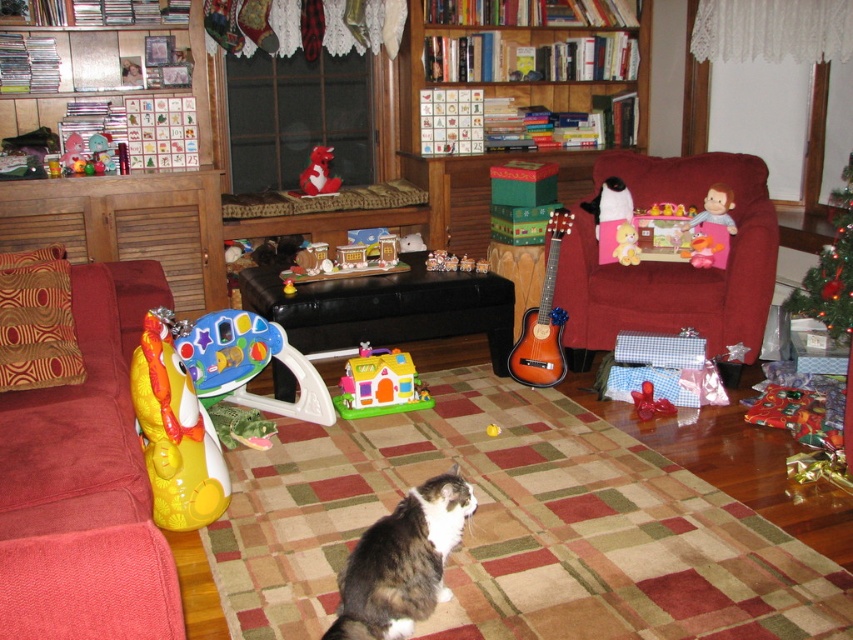
Question: Is matte plastic walker at center behind yellow rubber duck at center?

Choices:
 (A) yes
 (B) no

Answer: (B)

Question: Does matte plastic walker at center come behind green shiny christmas tree at upper right?

Choices:
 (A) no
 (B) yes

Answer: (A)

Question: Which point is closer to the camera?

Choices:
 (A) plastic house at center
 (B) matte plastic walker at center

Answer: (B)

Question: Does velvet plush armchair at right appear over rubber duck at center?

Choices:
 (A) no
 (B) yes

Answer: (A)

Question: Which object appears farthest from the camera in this image?

Choices:
 (A) velvet plush armchair at right
 (B) green shiny christmas tree at upper right
 (C) velvet red couch at left

Answer: (A)

Question: Which of the following is the farthest from the observer?

Choices:
 (A) (428, 188)
 (B) (44, 564)
 (C) (497, 429)
 (D) (212, 445)

Answer: (A)